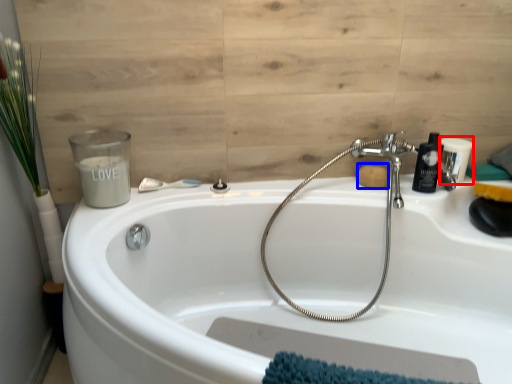
Question: Which point is closer to the camera, toiletry (highlighted by a red box) or soap (highlighted by a blue box)?

Choices:
 (A) toiletry
 (B) soap

Answer: (B)